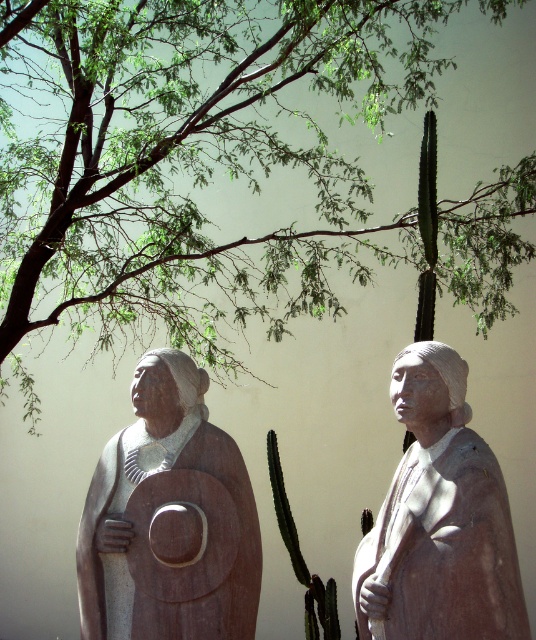
You are an artist planning to paint a landscape that includes both the green leafy tree at upper left and the smooth beige statue at center. Based on their sizes in the image, which object should you paint larger to maintain accurate proportions?

The green leafy tree at upper left should be painted larger since it has a greater height compared to the smooth beige statue at center.

Based on the photo, you are standing in front of the two statues. The matte stone shield at left is important for a ceremony. If you need to reach it without moving closer than 3 meters from the statues, can you safely touch it?

The matte stone shield at left is 3.61 meters away from the viewer. Since you need to stay at least 3 meters away, you can safely touch it as the distance allows you to be within the 3 meters limit while reaching.

You are an artist planning to paint a scene inspired by the image. You want to ensure the green leafy tree at upper left and the matte stone shield at left are proportionally accurate. Which object should you make larger in your painting?

The green leafy tree at upper left should be made larger than the matte stone shield at left because it is described as larger in size.